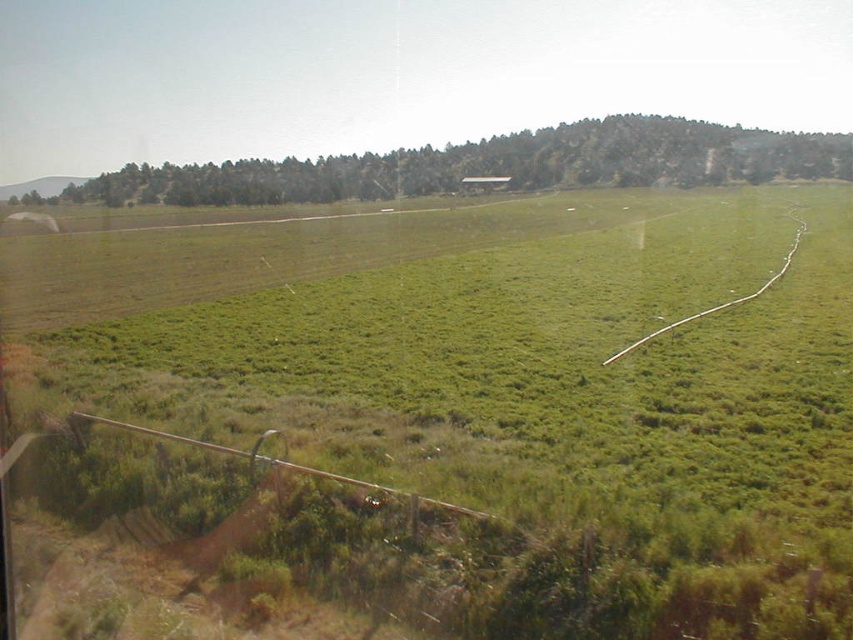
You are a farmer checking the health of your crops. You notice two areas in your field labeled as the green grassy field at center and the green grassy hillside at upper center. Which area has a more lush and dense vegetation cover?

The green grassy hillside at upper center has a more lush and dense vegetation cover since it is thicker than the green grassy field at center.

You are standing in the middle of the green grassy field at center and want to walk towards the green grassy hillside at upper center. Which direction should you head to reach it?

The green grassy hillside at upper center is located in the upper part of the image, so you should head upwards or towards the top of the field to reach it.

You are standing at the origin point in the image. Which direction should you walk to reach the green grassy field at center?

The green grassy field at center is located at point 0.662 on the x and 0.516 on the y. Since the coordinates are relative to the image, moving towards the center would involve heading towards the point given. However, the exact direction depends on the image orientation. Assuming standard image coordinates where the origin is the top left corner, the point is to the right and slightly below the center. Therefore, you should walk towards the right and slightly downward from your current position to reach it